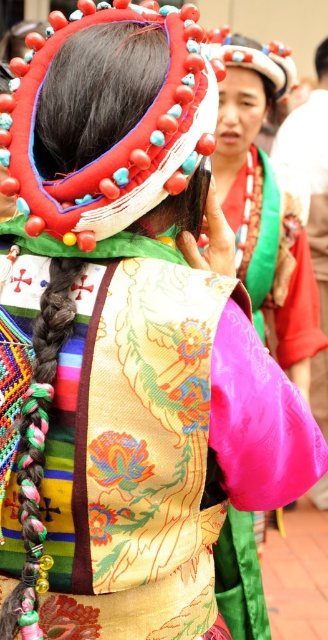
Question: Which object is the farthest from the silky pink fabric at center?

Choices:
 (A) matte black hair at upper center
 (B) matte red headdress at center
 (C) velvet-like red headdress at upper center

Answer: (A)

Question: Which is nearer to the matte red headdress at center?

Choices:
 (A) velvet-like red headdress at upper center
 (B) matte black hair at upper center
 (C) silky pink fabric at center

Answer: (C)

Question: Does silky pink fabric at center appear on the left side of matte black hair at upper center?

Choices:
 (A) no
 (B) yes

Answer: (B)

Question: Among these points, which one is nearest to the camera?

Choices:
 (A) (120, 154)
 (B) (271, 44)
 (C) (223, 148)

Answer: (A)

Question: Does velvet-like red headdress at upper center appear under matte red headdress at center?

Choices:
 (A) no
 (B) yes

Answer: (B)

Question: Where is silky pink fabric at center located in relation to matte red headdress at center in the image?

Choices:
 (A) right
 (B) left

Answer: (A)